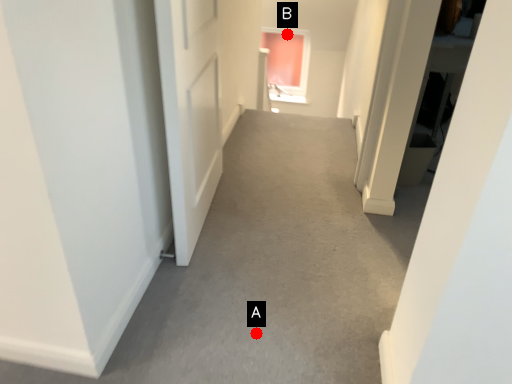
Question: Two points are circled on the image, labeled by A and B beside each circle. Which point is further to the camera?

Choices:
 (A) A is further
 (B) B is further

Answer: (B)